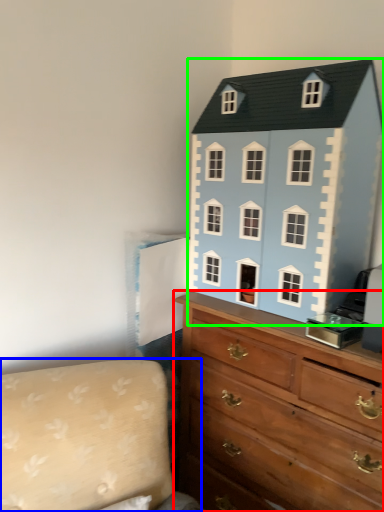
Question: Which is nearer to the chest of drawers (highlighted by a red box)? couch (highlighted by a blue box) or toy (highlighted by a green box).

Choices:
 (A) couch
 (B) toy

Answer: (B)